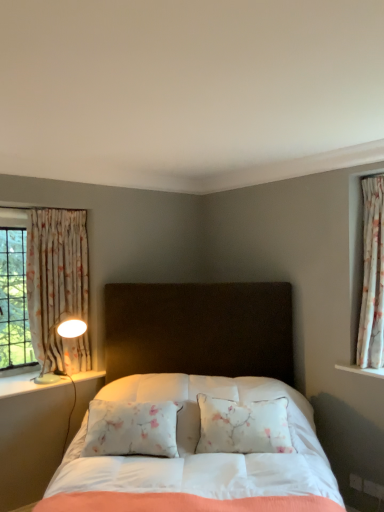
Question: Can you confirm if white glossy lamp at left is thinner than floral fabric curtain at right, which is the second curtain in left-to-right order?

Choices:
 (A) no
 (B) yes

Answer: (A)

Question: From the image's perspective, is white glossy lamp at left on floral fabric curtain at right, arranged as the 1th curtain when viewed from the right?

Choices:
 (A) no
 (B) yes

Answer: (A)

Question: From a real-world perspective, is white glossy lamp at left located higher than floral fabric curtain at right, arranged as the 1th curtain when viewed from the right?

Choices:
 (A) yes
 (B) no

Answer: (B)

Question: From the image's perspective, is white glossy lamp at left below floral fabric curtain at right, which is the 2th curtain from back to front?

Choices:
 (A) no
 (B) yes

Answer: (B)

Question: Is white glossy lamp at left placed right next to floral fabric curtain at right, arranged as the 1th curtain when viewed from the right?

Choices:
 (A) no
 (B) yes

Answer: (A)

Question: Is floral fabric curtain at right, which is the second curtain in left-to-right order, wider or thinner than white glossy lamp at left?

Choices:
 (A) thin
 (B) wide

Answer: (A)

Question: Is floral fabric curtain at right, the 1th curtain from the front, situated inside white glossy lamp at left or outside?

Choices:
 (A) outside
 (B) inside

Answer: (A)

Question: From the image's perspective, is floral fabric curtain at right, which is the 2th curtain from back to front, above or below white glossy lamp at left?

Choices:
 (A) below
 (B) above

Answer: (B)

Question: In terms of height, does floral fabric curtain at right, the 1th curtain from the front, look taller or shorter compared to white glossy lamp at left?

Choices:
 (A) short
 (B) tall

Answer: (B)

Question: Considering their positions, is white glossy lamp at left located in front of or behind white fabric bed at center?

Choices:
 (A) behind
 (B) front

Answer: (A)

Question: Is white glossy lamp at left bigger or smaller than white fabric bed at center?

Choices:
 (A) big
 (B) small

Answer: (B)

Question: From a real-world perspective, is white glossy lamp at left above or below white fabric bed at center?

Choices:
 (A) above
 (B) below

Answer: (A)

Question: Is point (21, 393) closer or farther from the camera than point (316, 495)?

Choices:
 (A) farther
 (B) closer

Answer: (A)

Question: Choose the correct answer: Is floral fabric curtain at left, arranged as the 2th curtain when viewed from the front, inside white fabric bed at center or outside it?

Choices:
 (A) inside
 (B) outside

Answer: (B)

Question: From a real-world perspective, is floral fabric curtain at left, acting as the first curtain starting from the back, physically located above or below white fabric bed at center?

Choices:
 (A) below
 (B) above

Answer: (B)